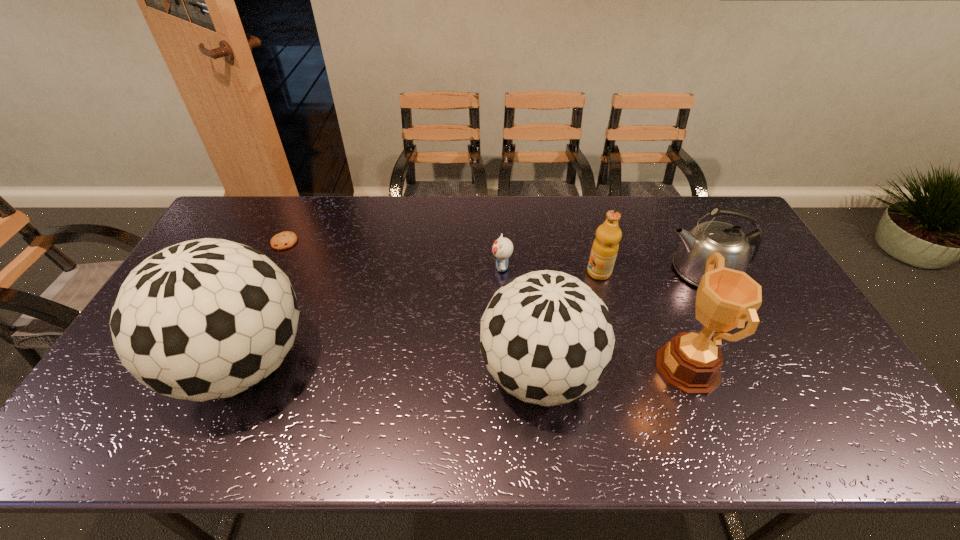
Observe the arrangement of all soccer balls in the image. To keep them evenly spaced, where would you place another soccer ball on the right? Please locate a free space. Please provide its 2D coordinates. Your answer should be formatted as a tuple, i.e. [(x, y)], where the tuple contains the x and y coordinates of a point satisfying the conditions above.

[(847, 384)]